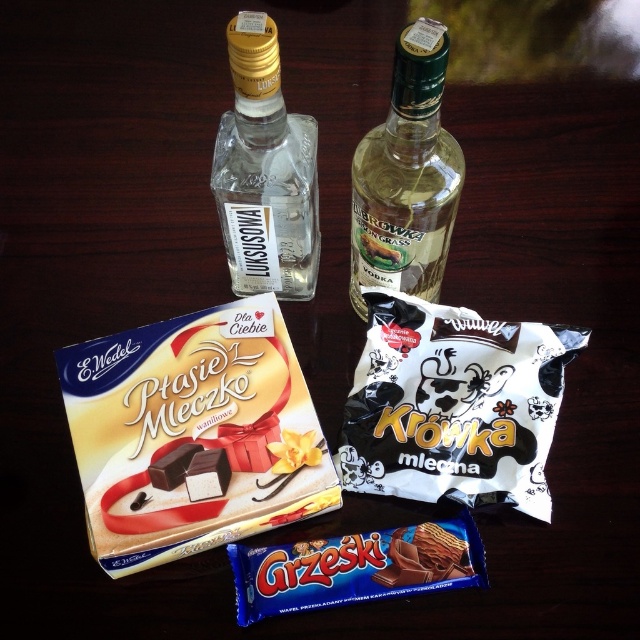
Question: Does transparent glass bottle at upper center appear on the left side of dark chocolate bar at center?

Choices:
 (A) no
 (B) yes

Answer: (A)

Question: Estimate the real-world distances between objects in this image. Which object is farther from the chocolate wafer at center?

Choices:
 (A) white matte krowka mleczna at center
 (B) dark chocolate bar at center
 (C) transparent glass bottle at upper center

Answer: (C)

Question: Which of the following is the closest to the observer?

Choices:
 (A) chocolate wafer at lower center
 (B) white matte krowka mleczna at center
 (C) transparent glass bottle at upper center
 (D) matte chocolate bar at center

Answer: (C)

Question: Is the position of white matte krowka mleczna at center less distant than that of chocolate wafer at lower center?

Choices:
 (A) yes
 (B) no

Answer: (B)

Question: Which object appears farthest from the camera in this image?

Choices:
 (A) chocolate wafer at center
 (B) transparent glass bottle at upper center
 (C) dark chocolate bar at center

Answer: (C)

Question: Where is white matte krowka mleczna at center located in relation to dark chocolate bar at center in the image?

Choices:
 (A) right
 (B) left

Answer: (A)